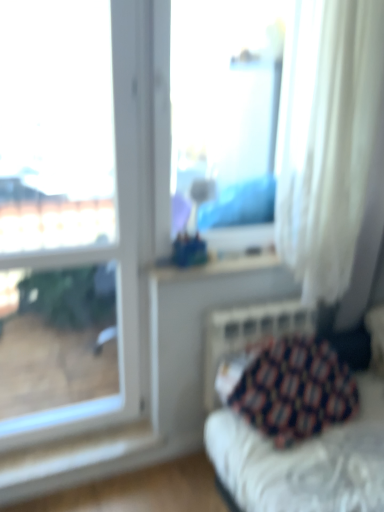
Image resolution: width=384 pixels, height=512 pixels. Describe the element at coordinates (304, 460) in the screenshot. I see `patterned fabric cushion at lower right` at that location.

Describe the element at coordinates (224, 89) in the screenshot. I see `transparent glass vase at center, marked as the second window in a left-to-right arrangement` at that location.

The width and height of the screenshot is (384, 512). What are the coordinates of `metallic silver radiator at lower right` in the screenshot? It's located at (248, 334).

The height and width of the screenshot is (512, 384). What do you see at coordinates (248, 334) in the screenshot? I see `metallic silver radiator at lower right` at bounding box center [248, 334].

Image resolution: width=384 pixels, height=512 pixels. What are the coordinates of `transparent glass window at upper left, which is counted as the second window, starting from the right` in the screenshot? It's located at (110, 246).

Considering the relative positions of transparent glass window at upper left, which is counted as the second window, starting from the right, and patterned fabric cushion at lower right in the image provided, is transparent glass window at upper left, which is counted as the second window, starting from the right, to the right of patterned fabric cushion at lower right from the viewer's perspective?

In fact, transparent glass window at upper left, which is counted as the second window, starting from the right, is to the left of patterned fabric cushion at lower right.

Is patterned fabric cushion at lower right completely or partially inside transparent glass window at upper left, which is counted as the second window, starting from the right?

No, patterned fabric cushion at lower right is located outside of transparent glass window at upper left, which is counted as the second window, starting from the right.

Considering the positions of point (115, 396) and point (233, 419), is point (115, 396) closer or farther from the camera than point (233, 419)?

Clearly, point (115, 396) is more distant from the camera than point (233, 419).

Between transparent glass window at upper left, which is counted as the second window, starting from the right, and patterned fabric cushion at lower right, which one is positioned in front?

transparent glass window at upper left, which is counted as the second window, starting from the right, is closer to the camera.

In the scene shown: Can you tell me how much patterned fabric cushion at lower right and transparent glass vase at center, which is the 1th window in right-to-left order, differ in facing direction?

6.62 degrees separate the facing orientations of patterned fabric cushion at lower right and transparent glass vase at center, which is the 1th window in right-to-left order.

From the image's perspective, which window is the 2nd one above the patterned fabric cushion at lower right? Please provide its 2D coordinates.

[(224, 89)]

Is patterned fabric cushion at lower right facing away from transparent glass vase at center, which is the 1th window in right-to-left order?

patterned fabric cushion at lower right does not have its back to transparent glass vase at center, which is the 1th window in right-to-left order.

From the image's perspective, relative to transparent glass vase at center, marked as the second window in a left-to-right arrangement, is patterned fabric cushion at lower right above or below?

patterned fabric cushion at lower right is below transparent glass vase at center, marked as the second window in a left-to-right arrangement.

Is transparent glass window at upper left, which is the first window from left to right, oriented towards white sheer curtain at right?

No, transparent glass window at upper left, which is the first window from left to right, does not turn towards white sheer curtain at right.

Are transparent glass window at upper left, which is counted as the second window, starting from the right, and white sheer curtain at right located far from each other?

No, transparent glass window at upper left, which is counted as the second window, starting from the right, is not far away from white sheer curtain at right.

Looking at their sizes, would you say transparent glass window at upper left, which is counted as the second window, starting from the right, is wider or thinner than white sheer curtain at right?

In the image, transparent glass window at upper left, which is counted as the second window, starting from the right, appears to be more narrow than white sheer curtain at right.

From a real-world perspective, is transparent glass window at upper left, which is the first window from left to right, under white sheer curtain at right?

Yes, from a real-world perspective, transparent glass window at upper left, which is the first window from left to right, is below white sheer curtain at right.

Which is correct: transparent glass vase at center, which is the 1th window in right-to-left order, is inside metallic silver radiator at lower right, or outside of it?

transparent glass vase at center, which is the 1th window in right-to-left order, is outside metallic silver radiator at lower right.

From the picture: From a real-world perspective, relative to metallic silver radiator at lower right, is transparent glass vase at center, marked as the second window in a left-to-right arrangement, vertically above or below?

In terms of real-world spatial position, transparent glass vase at center, marked as the second window in a left-to-right arrangement, is above metallic silver radiator at lower right.

Is transparent glass vase at center, which is the 1th window in right-to-left order, facing away from metallic silver radiator at lower right?

transparent glass vase at center, which is the 1th window in right-to-left order, is not turned away from metallic silver radiator at lower right.

Considering the points (217, 12) and (206, 358), which point is behind, point (217, 12) or point (206, 358)?

The point (217, 12) is behind.

How different are the orientations of white sheer curtain at right and transparent glass window at upper left, which is the first window from left to right, in degrees?

0.433 degrees.

Which is behind, point (355, 48) or point (121, 152)?

The point (121, 152) is farther from the camera.

Looking at their sizes, would you say white sheer curtain at right is wider or thinner than transparent glass window at upper left, which is the first window from left to right?

In the image, white sheer curtain at right appears to be wider than transparent glass window at upper left, which is the first window from left to right.

Considering the relative sizes of white sheer curtain at right and transparent glass window at upper left, which is counted as the second window, starting from the right, in the image provided, is white sheer curtain at right bigger than transparent glass window at upper left, which is counted as the second window, starting from the right,?

Indeed, white sheer curtain at right has a larger size compared to transparent glass window at upper left, which is counted as the second window, starting from the right.

How different are the orientations of patterned fabric cushion at lower right and white sheer curtain at right in degrees?

patterned fabric cushion at lower right and white sheer curtain at right are facing 5.73 degrees away from each other.

Considering the positions of objects patterned fabric cushion at lower right and white sheer curtain at right in the image provided, who is more to the right, patterned fabric cushion at lower right or white sheer curtain at right?

From the viewer's perspective, white sheer curtain at right appears more on the right side.

Is patterned fabric cushion at lower right next to white sheer curtain at right?

No, patterned fabric cushion at lower right is not beside white sheer curtain at right.

From a real-world perspective, between patterned fabric cushion at lower right and white sheer curtain at right, who is vertically lower?

patterned fabric cushion at lower right.

Looking at this image, from a real-world perspective, does transparent glass window at upper left, which is counted as the second window, starting from the right, stand above metallic silver radiator at lower right?

Yes, from a real-world perspective, transparent glass window at upper left, which is counted as the second window, starting from the right, is on top of metallic silver radiator at lower right.

Between point (29, 432) and point (206, 333), which one is positioned in front?

The point (206, 333) is closer.

Is transparent glass window at upper left, which is the first window from left to right, facing towards metallic silver radiator at lower right?

No, transparent glass window at upper left, which is the first window from left to right, does not turn towards metallic silver radiator at lower right.

Where is `the 2nd window counting from the left of the patterned fabric cushion at lower right`? This screenshot has width=384, height=512. the 2nd window counting from the left of the patterned fabric cushion at lower right is located at coordinates (110, 246).

At what (x,y) coordinates should I click in order to perform the action: click on window behind the patterned fabric cushion at lower right. Please return your answer as a coordinate pair (x, y). Looking at the image, I should click on (224, 89).

Looking at the image, which one is located closer to white sheer curtain at right, transparent glass window at upper left, which is counted as the second window, starting from the right, or metallic silver radiator at lower right?

metallic silver radiator at lower right lies closer to white sheer curtain at right than the other object.

Estimate the real-world distances between objects in this image. Which object is further from metallic silver radiator at lower right, white sheer curtain at right or patterned fabric cushion at lower right?

white sheer curtain at right is positioned further to the anchor metallic silver radiator at lower right.

From the image, which object appears to be farther from transparent glass vase at center, marked as the second window in a left-to-right arrangement, white sheer curtain at right or metallic silver radiator at lower right?

metallic silver radiator at lower right is positioned further to the anchor transparent glass vase at center, marked as the second window in a left-to-right arrangement.

When comparing their distances from metallic silver radiator at lower right, does patterned fabric cushion at lower right or transparent glass window at upper left, which is the first window from left to right, seem further?

Based on the image, transparent glass window at upper left, which is the first window from left to right, appears to be further to metallic silver radiator at lower right.

Looking at the image, which one is located closer to transparent glass vase at center, which is the 1th window in right-to-left order, white sheer curtain at right or patterned fabric cushion at lower right?

white sheer curtain at right is positioned closer to the anchor transparent glass vase at center, which is the 1th window in right-to-left order.

In the scene shown: Which object lies nearer to the anchor point metallic silver radiator at lower right, white sheer curtain at right or transparent glass vase at center, marked as the second window in a left-to-right arrangement?

white sheer curtain at right.

Which object lies further to the anchor point patterned fabric cushion at lower right, white sheer curtain at right or metallic silver radiator at lower right?

white sheer curtain at right.

Estimate the real-world distances between objects in this image. Which object is further from transparent glass window at upper left, which is counted as the second window, starting from the right, white sheer curtain at right or patterned fabric cushion at lower right?

Among the two, patterned fabric cushion at lower right is located further to transparent glass window at upper left, which is counted as the second window, starting from the right.

You are a GUI agent. You are given a task and a screenshot of the screen. Output one action in this format:
    pyautogui.click(x=<x>, y=<y>)
    Task: Click on the curtain between transparent glass vase at center, which is the 1th window in right-to-left order, and metallic silver radiator at lower right, in the vertical direction
    The image size is (384, 512).
    Given the screenshot: What is the action you would take?
    pyautogui.click(x=328, y=138)

In order to click on radiator located between transparent glass window at upper left, which is counted as the second window, starting from the right, and white sheer curtain at right in the left-right direction in this screenshot , I will do `click(248, 334)`.

At what (x,y) coordinates should I click in order to perform the action: click on window between transparent glass vase at center, which is the 1th window in right-to-left order, and patterned fabric cushion at lower right vertically. Please return your answer as a coordinate pair (x, y). The width and height of the screenshot is (384, 512). Looking at the image, I should click on (110, 246).

The width and height of the screenshot is (384, 512). I want to click on radiator that lies between transparent glass vase at center, which is the 1th window in right-to-left order, and patterned fabric cushion at lower right from top to bottom, so click(x=248, y=334).